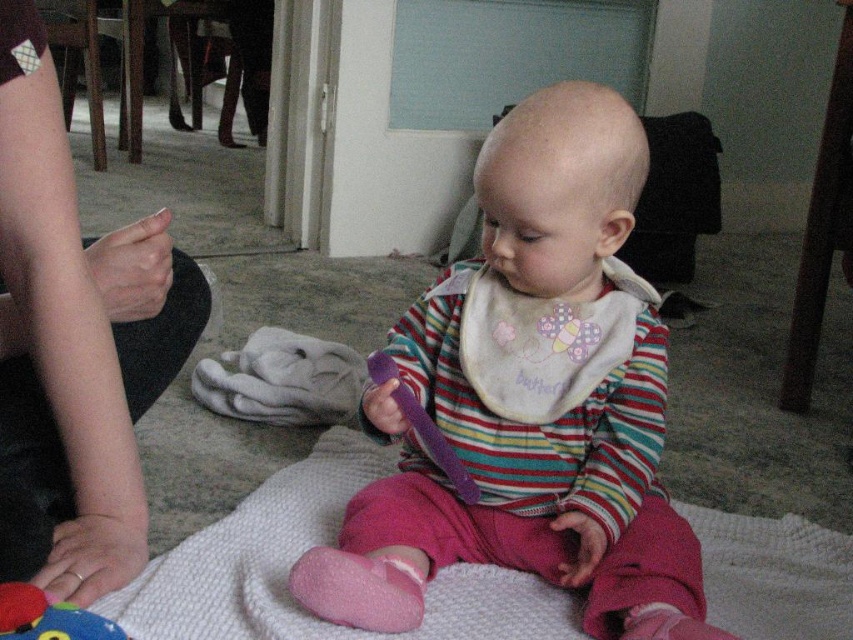
Does smooth skin arm at lower left have a greater height compared to rubber teething ring at lower left?

Indeed, smooth skin arm at lower left has a greater height compared to rubber teething ring at lower left.

Can you confirm if smooth skin arm at lower left is bigger than rubber teething ring at lower left?

Yes, smooth skin arm at lower left is bigger than rubber teething ring at lower left.

Between point (201, 305) and point (79, 573), which one is positioned behind?

Positioned behind is point (201, 305).

The height and width of the screenshot is (640, 853). In order to click on smooth skin arm at lower left in this screenshot , I will do `click(74, 344)`.

Between soft plush toy at lower left and rubber teething ring at lower left, which one is positioned higher?

soft plush toy at lower left

Does soft plush toy at lower left appear under rubber teething ring at lower left?

No.

From the picture: Who is more distant from viewer, (4, 636) or (73, 568)?

The point (73, 568) is more distant.

This screenshot has width=853, height=640. Find the location of `soft plush toy at lower left`. soft plush toy at lower left is located at coordinates (48, 618).

Where is `matte purple spoon at center`? matte purple spoon at center is located at coordinates pyautogui.click(x=531, y=400).

Where is `matte purple spoon at center`? The image size is (853, 640). matte purple spoon at center is located at coordinates (531, 400).